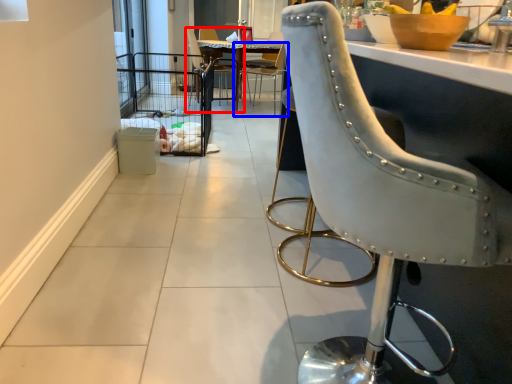
Question: Which of the following is the closest to the observer, chair (highlighted by a red box) or chair (highlighted by a blue box)?

Choices:
 (A) chair
 (B) chair

Answer: (B)